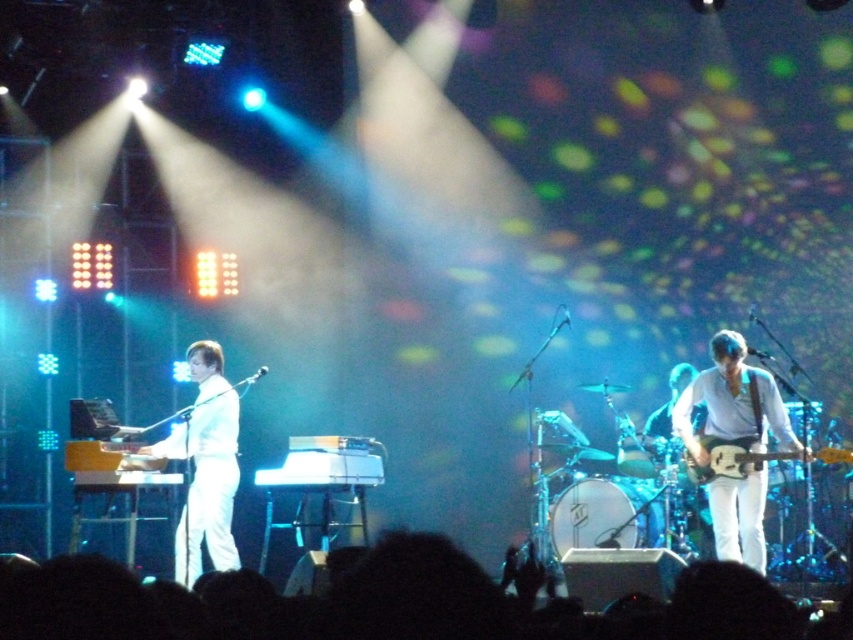
Is point (775, 404) closer to viewer compared to point (715, 464)?

No, it is behind (715, 464).

Between white matte guitar at right and electric guitar at right, which one is positioned lower?

Positioned lower is electric guitar at right.

Between point (733, 420) and point (798, 456), which one is positioned behind?

Point (733, 420)

Image resolution: width=853 pixels, height=640 pixels. Identify the location of white matte guitar at right. (733, 403).

Who is higher up, white glossy piano at left or electric guitar at right?

Positioned higher is electric guitar at right.

Which of these two, white glossy piano at left or electric guitar at right, stands taller?

white glossy piano at left

Does point (231, 564) lie behind point (837, 461)?

Yes, it is behind point (837, 461).

In order to click on white glossy piano at left in this screenshot , I will do `click(206, 467)`.

Does white matte guitar at right appear on the right side of white glossy piano at left?

Correct, you'll find white matte guitar at right to the right of white glossy piano at left.

Is point (762, 401) farther from camera compared to point (219, 376)?

No, it is in front of (219, 376).

This screenshot has width=853, height=640. Find the location of `white matte guitar at right`. white matte guitar at right is located at coordinates (733, 403).